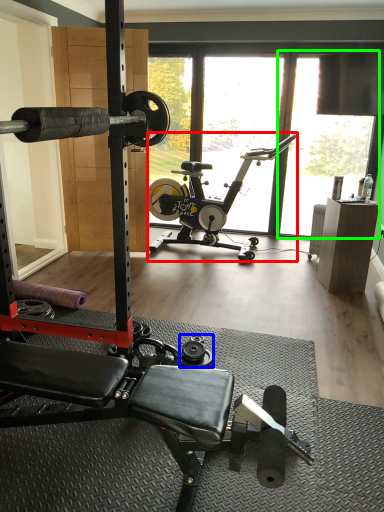
Question: Based on their relative distances, which object is farther from stationary bicycle (highlighted by a red box)? Choose from dumbbell (highlighted by a blue box) and window screen (highlighted by a green box).

Choices:
 (A) dumbbell
 (B) window screen

Answer: (A)